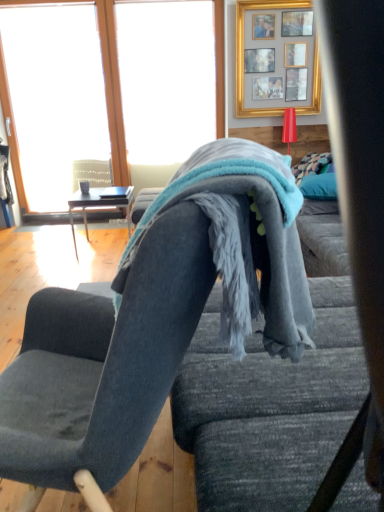
Question: Is teal plush pillow at right shorter than velvet dark gray chair at center?

Choices:
 (A) yes
 (B) no

Answer: (A)

Question: From a real-world perspective, is teal plush pillow at right over velvet dark gray chair at center?

Choices:
 (A) yes
 (B) no

Answer: (A)

Question: Is teal plush pillow at right to the left of velvet dark gray chair at center from the viewer's perspective?

Choices:
 (A) yes
 (B) no

Answer: (B)

Question: Considering the relative positions of teal plush pillow at right and velvet dark gray chair at center in the image provided, is teal plush pillow at right behind velvet dark gray chair at center?

Choices:
 (A) no
 (B) yes

Answer: (B)

Question: Does teal plush pillow at right have a lesser width compared to velvet dark gray chair at center?

Choices:
 (A) yes
 (B) no

Answer: (A)

Question: Is there a large distance between teal plush pillow at right and velvet dark gray chair at center?

Choices:
 (A) no
 (B) yes

Answer: (B)

Question: From a real-world perspective, is teal plush pillow at right physically above transparent glass window at upper left?

Choices:
 (A) no
 (B) yes

Answer: (A)

Question: Is the position of teal plush pillow at right more distant than that of transparent glass window at upper left?

Choices:
 (A) yes
 (B) no

Answer: (B)

Question: Is teal plush pillow at right not close to transparent glass window at upper left?

Choices:
 (A) yes
 (B) no

Answer: (A)

Question: Is teal plush pillow at right smaller than transparent glass window at upper left?

Choices:
 (A) no
 (B) yes

Answer: (B)

Question: Considering the relative sizes of teal plush pillow at right and transparent glass window at upper left in the image provided, is teal plush pillow at right shorter than transparent glass window at upper left?

Choices:
 (A) yes
 (B) no

Answer: (A)

Question: Is teal plush pillow at right bigger than transparent glass window at upper left?

Choices:
 (A) no
 (B) yes

Answer: (A)

Question: Is soft blue fleece blanket at center closer to camera compared to transparent glass window at upper left?

Choices:
 (A) no
 (B) yes

Answer: (B)